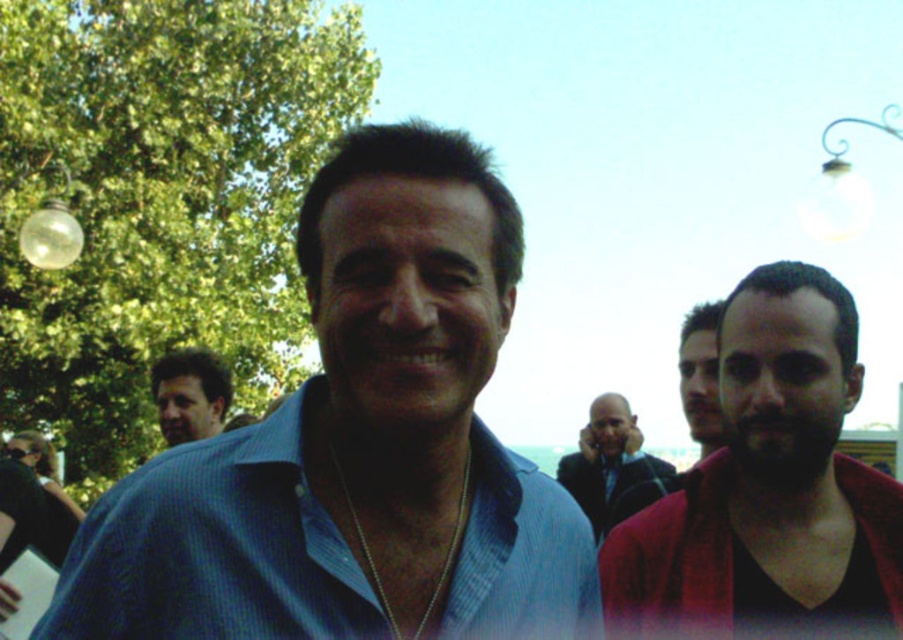
You are a photographer trying to capture a group photo. You notice the blue textured shirt at center and the smooth red jacket at right in your frame. Which of these two items should you adjust your camera angle to focus on first if you want to ensure both are in focus, considering their sizes in the frame?

The blue textured shirt at center is much taller than the smooth red jacket at right, so focusing on the larger object first would help ensure both are in focus.

You are a photographer trying to focus on the blue textured shirt at center and the brown leather jacket at left. Which one should you adjust your camera focus to first if you want to capture both clearly?

The blue textured shirt at center is closer to the viewer than the brown leather jacket at left, so you should focus on the blue textured shirt at center first to ensure both are in focus.

Where is the blue textured shirt at center located in the image?

The blue textured shirt at center is located at point 0.697 on the x axis and 0.395 on the y axis.